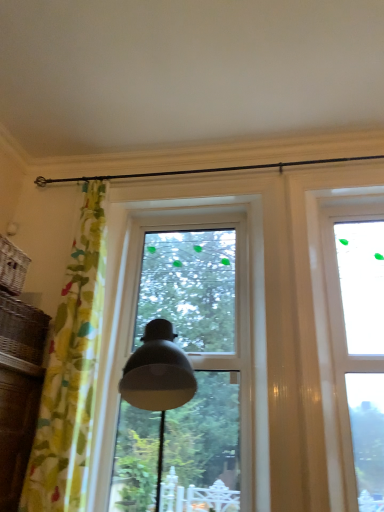
Question: From a real-world perspective, is woven brown basket at left, the 1th basket from the bottom, on top of yellow floral fabric curtain at left?

Choices:
 (A) yes
 (B) no

Answer: (B)

Question: Is woven brown basket at left, which ranks as the 2th basket in top-to-bottom order, to the left of yellow floral fabric curtain at left from the viewer's perspective?

Choices:
 (A) yes
 (B) no

Answer: (A)

Question: From the image's perspective, is woven brown basket at left, the 1th basket from the bottom, beneath yellow floral fabric curtain at left?

Choices:
 (A) yes
 (B) no

Answer: (A)

Question: Does woven brown basket at left, which ranks as the 2th basket in top-to-bottom order, turn towards yellow floral fabric curtain at left?

Choices:
 (A) no
 (B) yes

Answer: (B)

Question: Is woven brown basket at left, which ranks as the 2th basket in top-to-bottom order, taller than yellow floral fabric curtain at left?

Choices:
 (A) yes
 (B) no

Answer: (B)

Question: Considering the positions of woven brown basket at left, which ranks as the 2th basket in top-to-bottom order, and transparent glass window at center, arranged as the 2th window when viewed from the right, in the image, is woven brown basket at left, which ranks as the 2th basket in top-to-bottom order, wider or thinner than transparent glass window at center, arranged as the 2th window when viewed from the right,?

Choices:
 (A) thin
 (B) wide

Answer: (B)

Question: Considering their positions, is woven brown basket at left, which ranks as the 2th basket in top-to-bottom order, located in front of or behind transparent glass window at center, arranged as the 2th window when viewed from the right?

Choices:
 (A) behind
 (B) front

Answer: (B)

Question: In terms of height, does woven brown basket at left, which ranks as the 2th basket in top-to-bottom order, look taller or shorter compared to transparent glass window at center, arranged as the 2th window when viewed from the right?

Choices:
 (A) tall
 (B) short

Answer: (B)

Question: Is woven brown basket at left, the 1th basket from the bottom, to the left or to the right of transparent glass window at center, marked as the first window in a left-to-right arrangement, in the image?

Choices:
 (A) left
 (B) right

Answer: (A)

Question: Is transparent glass window at upper right, which is counted as the 1th window, starting from the right, inside or outside of woven brown basket at left, the 1th basket from the bottom?

Choices:
 (A) outside
 (B) inside

Answer: (A)

Question: In terms of width, does transparent glass window at upper right, the second window in the left-to-right sequence, look wider or thinner when compared to woven brown basket at left, which ranks as the 2th basket in top-to-bottom order?

Choices:
 (A) wide
 (B) thin

Answer: (B)

Question: From the image's perspective, is transparent glass window at upper right, the second window in the left-to-right sequence, positioned above or below woven brown basket at left, the 1th basket from the bottom?

Choices:
 (A) below
 (B) above

Answer: (A)

Question: Is transparent glass window at upper right, the second window in the left-to-right sequence, in front of or behind woven brown basket at left, which ranks as the 2th basket in top-to-bottom order, in the image?

Choices:
 (A) front
 (B) behind

Answer: (B)

Question: From a real-world perspective, is woven brown basket at left, the 1th basket from the bottom, positioned above or below transparent glass window at upper right, which is counted as the 1th window, starting from the right?

Choices:
 (A) above
 (B) below

Answer: (B)

Question: Considering the positions of woven brown basket at left, which ranks as the 2th basket in top-to-bottom order, and transparent glass window at upper right, which is counted as the 1th window, starting from the right, in the image, is woven brown basket at left, which ranks as the 2th basket in top-to-bottom order, taller or shorter than transparent glass window at upper right, which is counted as the 1th window, starting from the right,?

Choices:
 (A) tall
 (B) short

Answer: (B)